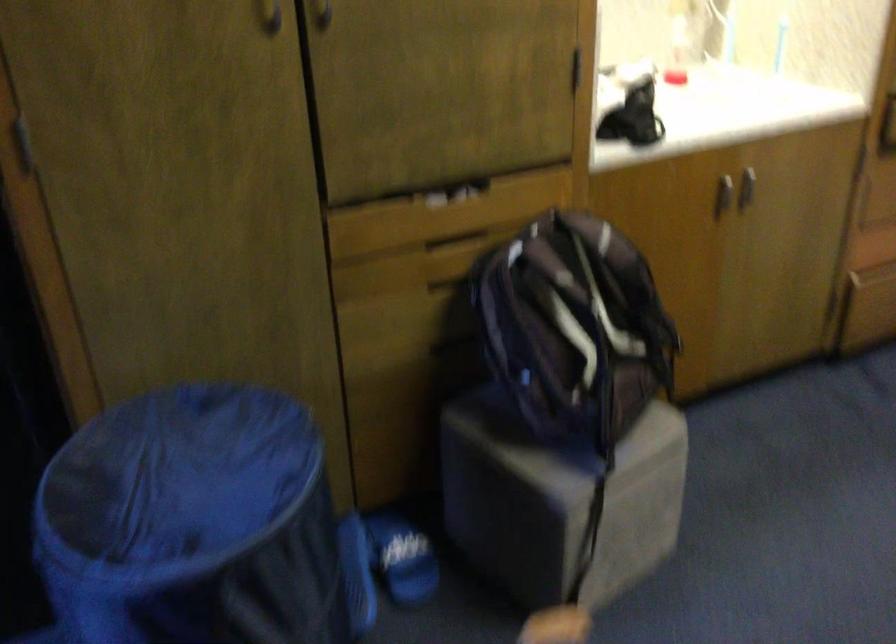
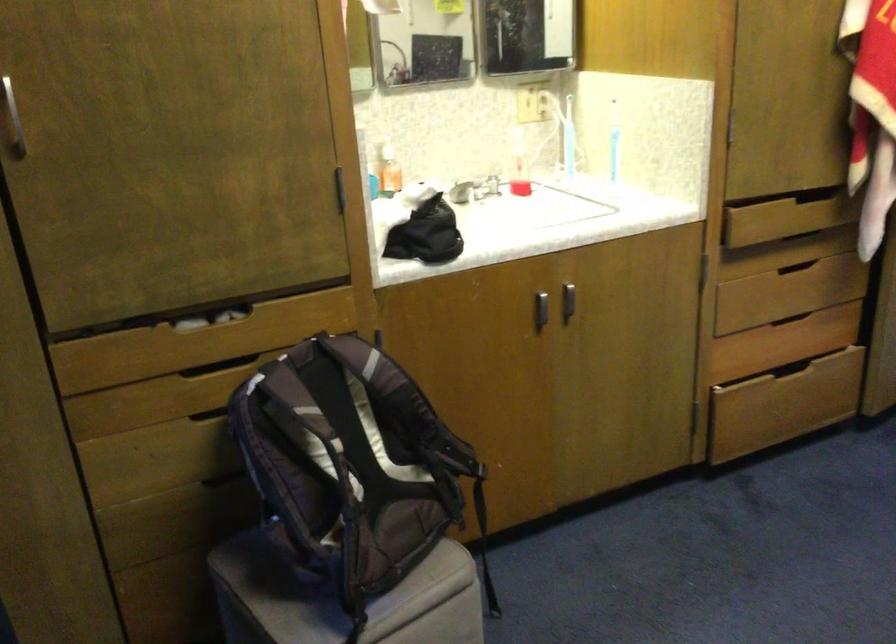
Question: Based on the continuous images, in which direction is the camera rotating? Reply with the corresponding letter.

Choices:
 (A) Left
 (B) Right
 (C) Up
 (D) Down

Answer: (C)